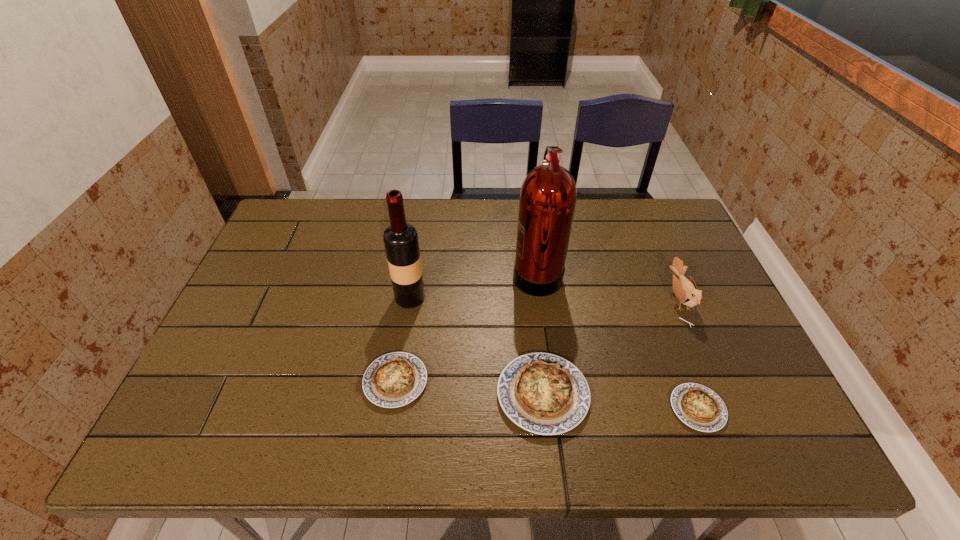
Identify the location of the fifth tallest object. The image size is (960, 540). (395, 379).

Identify the location of the leftmost quiche. (395, 379).

Locate an element on the screen. the tallest quiche is located at coordinates (543, 393).

Where is `the second quiche from left to right`? Image resolution: width=960 pixels, height=540 pixels. the second quiche from left to right is located at coordinates (543, 393).

Find the location of `the shortest object`. the shortest object is located at coordinates (699, 407).

Locate an element on the screen. Image resolution: width=960 pixels, height=540 pixels. the shortest quiche is located at coordinates (699, 407).

The width and height of the screenshot is (960, 540). I want to click on fire extinguisher, so click(x=548, y=195).

In order to click on wine bottle in this screenshot , I will do `click(401, 243)`.

The width and height of the screenshot is (960, 540). In order to click on bird in this screenshot , I will do `click(686, 291)`.

Where is `vacant position located on the right of the second shortest object`? vacant position located on the right of the second shortest object is located at coordinates (462, 381).